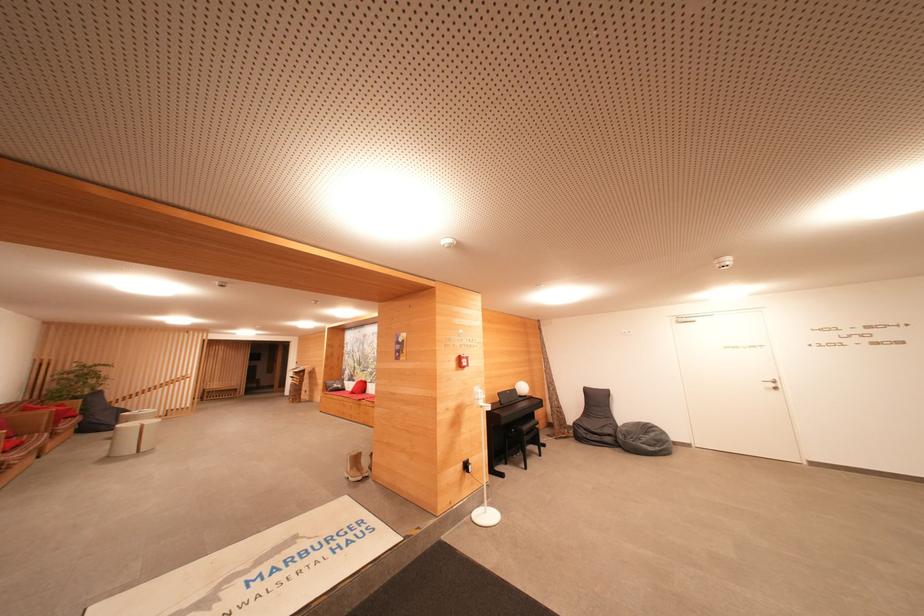
The height and width of the screenshot is (616, 924). What do you see at coordinates (772, 379) in the screenshot?
I see `the silver door handle` at bounding box center [772, 379].